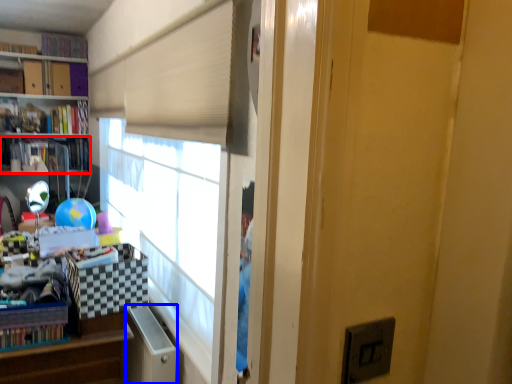
Question: Which of the following is the closest to the observer, book (highlighted by a red box) or file cabinet (highlighted by a blue box)?

Choices:
 (A) book
 (B) file cabinet

Answer: (B)